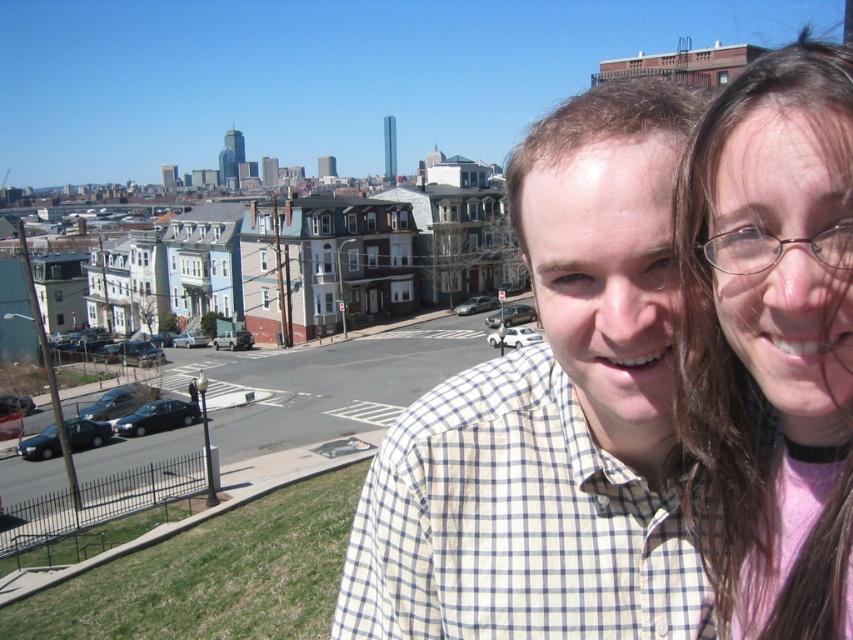
You are a photographer trying to capture a wide shot of the scene. The white checkered shirt at center and the pink fabric at upper right are both in your frame. Which object should you adjust your focus to ensure the wider object remains sharp?

The white checkered shirt at center has a larger width than the pink fabric at upper right, so you should focus on the white checkered shirt at center to ensure the wider object remains sharp.